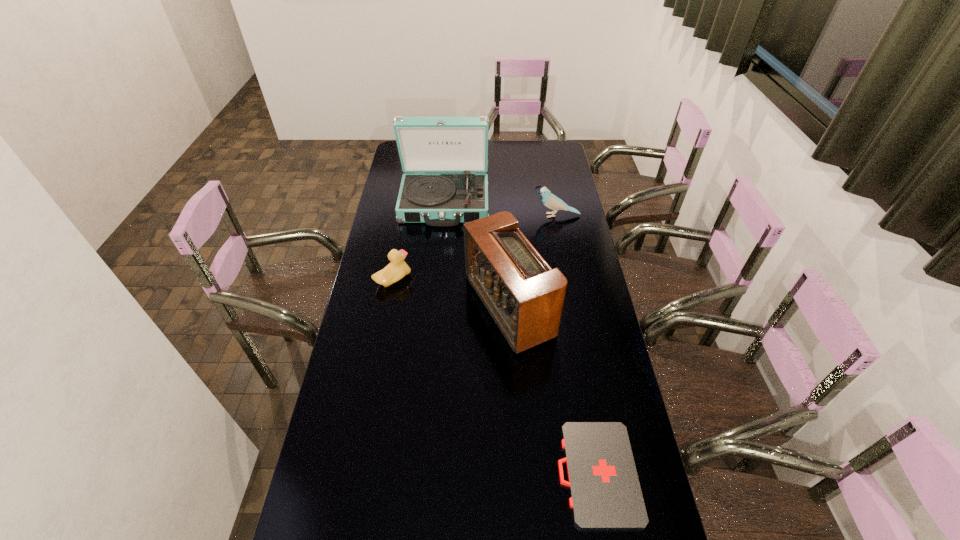
Locate an element on the screen. This screenshot has height=540, width=960. vacant space at the right edge of the desktop is located at coordinates 602,307.

In the image, there is a desktop. At what (x,y) coordinates should I click in order to perform the action: click on vacant space at the far left corner. Please return your answer as a coordinate pair (x, y). This screenshot has height=540, width=960. Looking at the image, I should click on (396, 153).

Identify the location of vacant space at the far right corner. (543, 156).

Locate an element on the screen. The height and width of the screenshot is (540, 960). free area in between the second shortest object and the tallest object is located at coordinates (419, 241).

Identify the location of free space between the tallest object and the fourth tallest object. (419, 241).

At what (x,y) coordinates should I click in order to perform the action: click on free spot between the bird and the record player. Please return your answer as a coordinate pair (x, y). Looking at the image, I should click on (500, 209).

Locate an element on the screen. This screenshot has width=960, height=540. vacant space that is in between the fourth shortest object and the shortest object is located at coordinates (553, 390).

At what (x,y) coordinates should I click in order to perform the action: click on unoccupied position between the bird and the nearest object. Please return your answer as a coordinate pair (x, y). This screenshot has width=960, height=540. Looking at the image, I should click on 577,345.

Locate an element on the screen. This screenshot has width=960, height=540. blank region between the tallest object and the fourth tallest object is located at coordinates (419, 241).

This screenshot has width=960, height=540. I want to click on object that is the nearest to the bird, so click(448, 149).